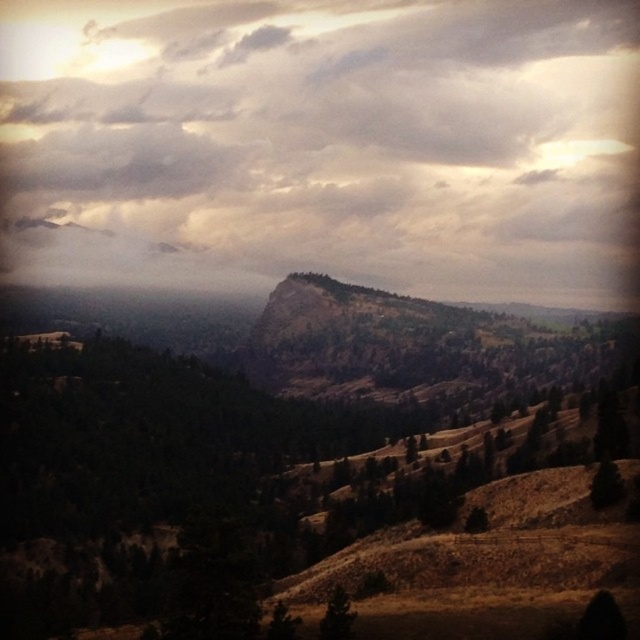
Can you confirm if green matte tree at lower center is taller than green matte tree at center?

Indeed, green matte tree at lower center has a greater height compared to green matte tree at center.

Which of these two, green matte tree at lower center or green matte tree at center, stands taller?

With more height is green matte tree at lower center.

The image size is (640, 640). What are the coordinates of `green matte tree at lower center` in the screenshot? It's located at (337, 616).

From the picture: Does green matte tree at lower right have a lesser width compared to green matte tree at center?

No.

Describe the element at coordinates (605, 484) in the screenshot. I see `green matte tree at lower right` at that location.

Between point (611, 504) and point (484, 513), which one is positioned behind?

The point (484, 513) is more distant.

Image resolution: width=640 pixels, height=640 pixels. I want to click on green matte tree at lower right, so click(x=605, y=484).

Between cloudy sky at upper center and green matte tree at lower center, which one has more height?

cloudy sky at upper center

Measure the distance between cloudy sky at upper center and camera.

The distance of cloudy sky at upper center from camera is 1538.30 feet.

Locate an element on the screen. cloudy sky at upper center is located at coordinates (326, 140).